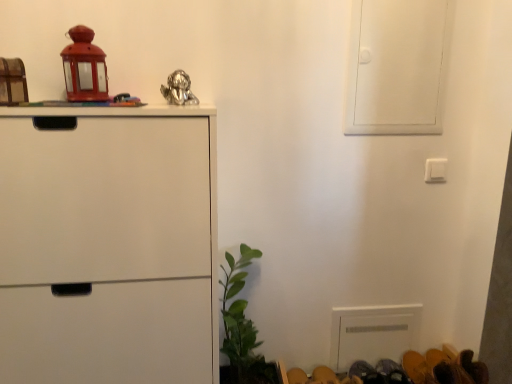
Question: Is white matte cabinet at left oriented towards shiny metallic figurine at upper center, which is the 1th toy in right-to-left order?

Choices:
 (A) yes
 (B) no

Answer: (B)

Question: Is white matte cabinet at left not near shiny metallic figurine at upper center, which is the 3th toy from left to right?

Choices:
 (A) yes
 (B) no

Answer: (B)

Question: From the image's perspective, is white matte cabinet at left on shiny metallic figurine at upper center, which is the 3th toy from left to right?

Choices:
 (A) yes
 (B) no

Answer: (B)

Question: Is white matte cabinet at left to the left of shiny metallic figurine at upper center, which is the 3th toy from left to right, from the viewer's perspective?

Choices:
 (A) no
 (B) yes

Answer: (B)

Question: Is white matte cabinet at left taller than shiny metallic figurine at upper center, which is the 3th toy from left to right?

Choices:
 (A) yes
 (B) no

Answer: (A)

Question: Which is correct: matte red lantern at upper left, marked as the second toy in a right-to-left arrangement, is inside white matte screen door at upper right, or outside of it?

Choices:
 (A) inside
 (B) outside

Answer: (B)

Question: Does point (73, 38) appear closer or farther from the camera than point (364, 119)?

Choices:
 (A) farther
 (B) closer

Answer: (B)

Question: Considering the positions of matte red lantern at upper left, marked as the second toy in a right-to-left arrangement, and white matte screen door at upper right in the image, is matte red lantern at upper left, marked as the second toy in a right-to-left arrangement, bigger or smaller than white matte screen door at upper right?

Choices:
 (A) small
 (B) big

Answer: (A)

Question: In the image, is matte red lantern at upper left, which is the 2th toy from left to right, positioned in front of or behind white matte screen door at upper right?

Choices:
 (A) front
 (B) behind

Answer: (A)

Question: From a real-world perspective, relative to white matte screen door at upper right, is green leafy plant at lower center vertically above or below?

Choices:
 (A) below
 (B) above

Answer: (A)

Question: In the image, is green leafy plant at lower center positioned in front of or behind white matte screen door at upper right?

Choices:
 (A) front
 (B) behind

Answer: (A)

Question: In terms of height, does green leafy plant at lower center look taller or shorter compared to white matte screen door at upper right?

Choices:
 (A) short
 (B) tall

Answer: (B)

Question: From the image's perspective, relative to white matte screen door at upper right, is green leafy plant at lower center above or below?

Choices:
 (A) above
 (B) below

Answer: (B)

Question: From their relative heights in the image, would you say shiny metallic figurine at upper center, which is the 3th toy from left to right, is taller or shorter than white matte screen door at upper right?

Choices:
 (A) short
 (B) tall

Answer: (A)

Question: From a real-world perspective, is shiny metallic figurine at upper center, which is the 3th toy from left to right, positioned above or below white matte screen door at upper right?

Choices:
 (A) below
 (B) above

Answer: (A)